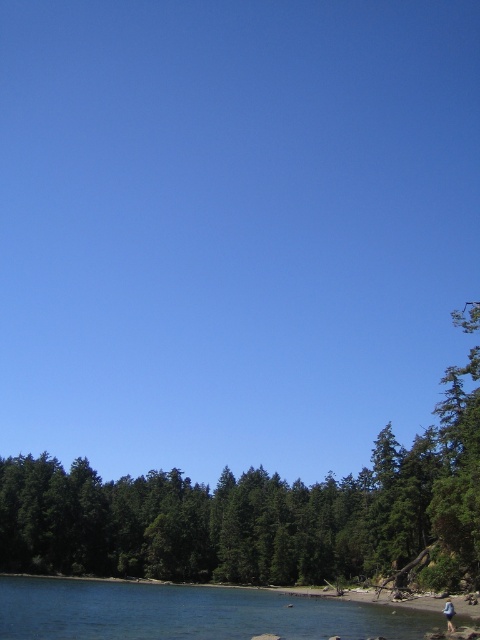
Consider the image. Can you confirm if green leafy tree at lower center is positioned below blue denim jeans at lower right?

Yes.

Is green leafy tree at lower center to the left of blue denim jeans at lower right from the viewer's perspective?

Correct, you'll find green leafy tree at lower center to the left of blue denim jeans at lower right.

Does point (439, 579) come closer to viewer compared to point (448, 611)?

No, (439, 579) is behind (448, 611).

Find the location of a particular element. green leafy tree at lower center is located at coordinates (262, 513).

Which of these two, clear blue water at lower left or blue denim jeans at lower right, stands shorter?

With less height is blue denim jeans at lower right.

Find the location of `clear blue water at lower left`. clear blue water at lower left is located at coordinates (192, 612).

Which is behind, point (443, 561) or point (197, 602)?

The point (443, 561) is behind.

Does point (333, 538) come farther from viewer compared to point (132, 634)?

Yes, it is.

Find the location of a particular element. green leafy tree at lower center is located at coordinates (262, 513).